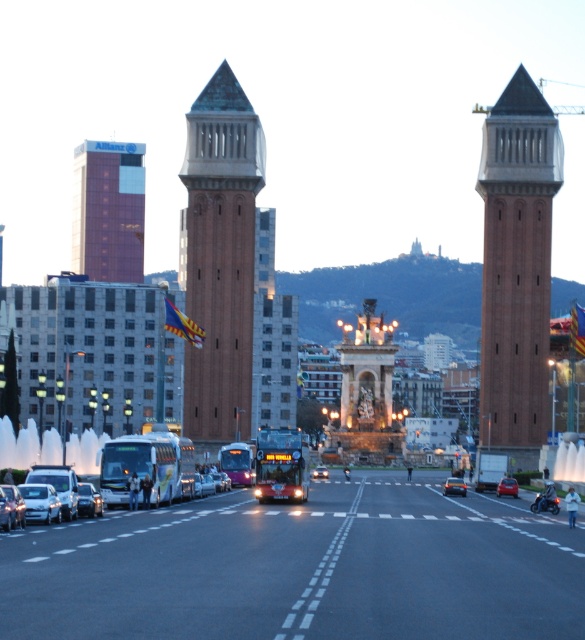
Question: Considering the relative positions of brown brick bell tower at right and metallic silver car at lower left in the image provided, where is brown brick bell tower at right located with respect to metallic silver car at lower left?

Choices:
 (A) right
 (B) left

Answer: (A)

Question: Which object is positioned farthest from the metallic purple bus at center?

Choices:
 (A) silver metallic car at center
 (B) brown brick bell tower at center

Answer: (A)

Question: Does white glossy bus at center have a lesser width compared to silver metallic car at lower left?

Choices:
 (A) yes
 (B) no

Answer: (B)

Question: Does metallic silver car at lower left appear on the right side of metallic silver car at center?

Choices:
 (A) no
 (B) yes

Answer: (A)

Question: Which object is closer to the camera taking this photo?

Choices:
 (A) metallic purple bus at center
 (B) white glossy bus at center

Answer: (B)

Question: Which of the following is the closest to the observer?

Choices:
 (A) red brick building at upper left
 (B) brown brick bell tower at center
 (C) silver metallic car at lower left

Answer: (C)